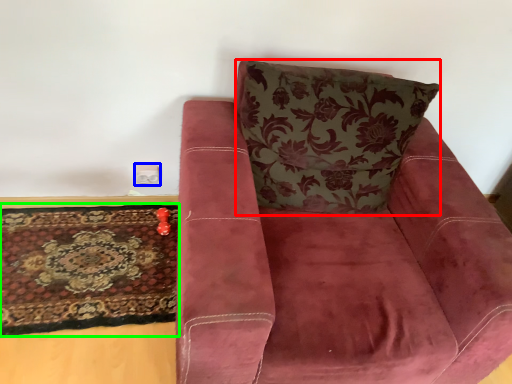
Question: Considering the real-world distances, which object is closest to throw pillow (highlighted by a red box)? electric outlet (highlighted by a blue box) or mat (highlighted by a green box).

Choices:
 (A) electric outlet
 (B) mat

Answer: (B)